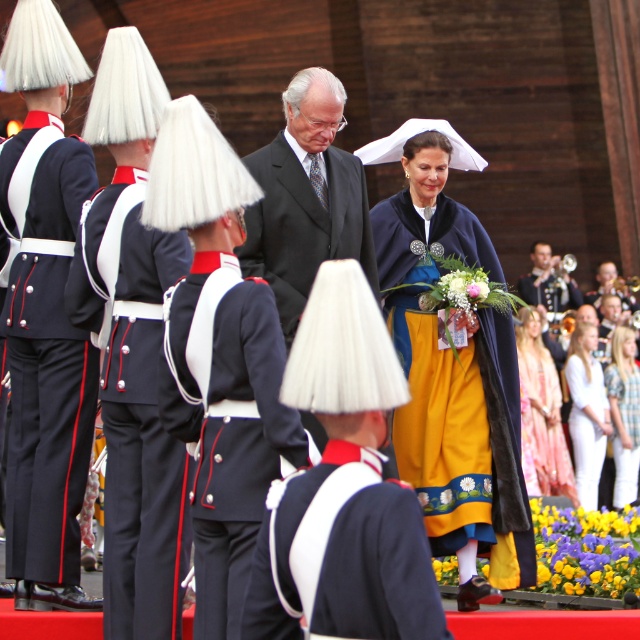
Question: Which object appears closest to the camera in this image?

Choices:
 (A) silky pink dress at center
 (B) dark gray suit at center

Answer: (B)

Question: Does navy blue fabric pants at left come in front of navy blue fabric uniform at center?

Choices:
 (A) no
 (B) yes

Answer: (A)

Question: Does shiny silver trumpet at right appear on the left side of smooth gold trumpet at right?

Choices:
 (A) yes
 (B) no

Answer: (A)

Question: Which object is closer to the camera taking this photo?

Choices:
 (A) navy blue fabric pants at left
 (B) navy blue fabric uniform at center

Answer: (B)

Question: Which point is closer to the camera?

Choices:
 (A) (317, 108)
 (B) (621, 304)
 (C) (380, 544)
 (D) (61, 147)

Answer: (C)

Question: From the image, what is the correct spatial relationship of navy blue fabric trousers at left in relation to navy blue wool uniform at center?

Choices:
 (A) right
 (B) left

Answer: (B)